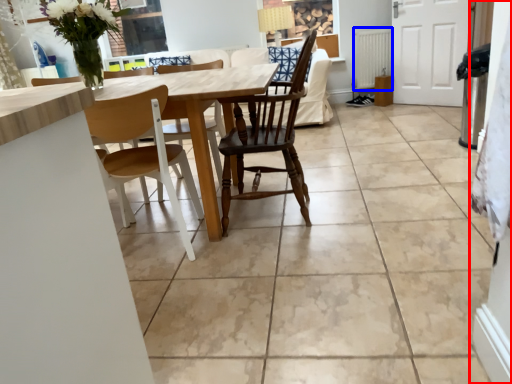
Question: Which object appears closest to the camera in this image, side (highlighted by a red box) or radiator (highlighted by a blue box)?

Choices:
 (A) side
 (B) radiator

Answer: (A)